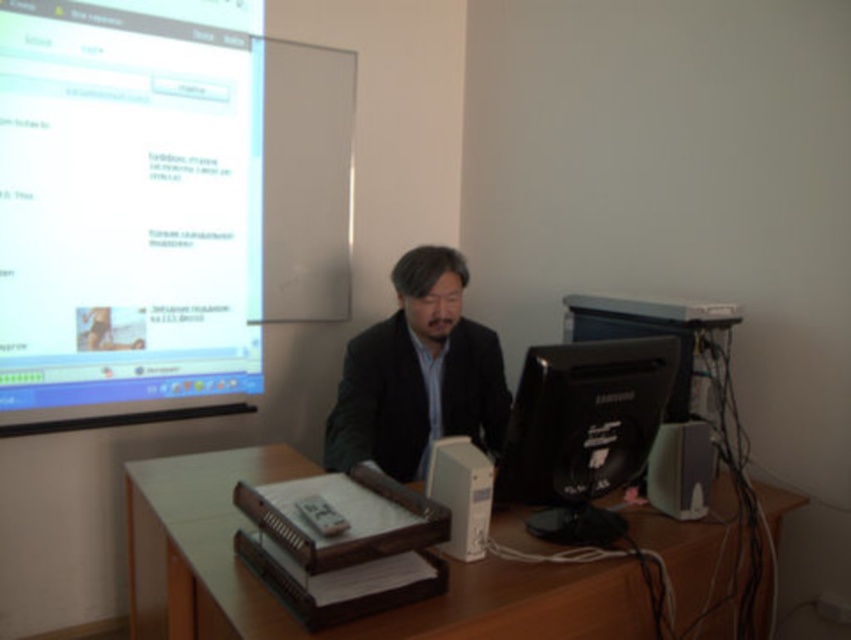
You are standing at the edge of the desk where the person is sitting. The person is facing the computer screen. If you want to reach the matte white projector screen at upper left without moving your feet, can you do it? Please consider the distance between you and the screen.

The distance between you and the matte white projector screen at upper left is 7.31 feet. Since you cannot move your feet, reaching 7.31 feet away is not possible without assistance or stretching beyond typical arm reach.

You are a student in the classroom. You need to locate the point at coordinates (x=124, y=204). Where would you find it?

The point at coordinates (x=124, y=204) is on the matte white projector screen at upper left.

Based on the scene description, which object is larger in size between the matte white projector screen at upper left and the black glossy monitor at center?

The matte white projector screen at upper left is bigger than the black glossy monitor at center according to the description.